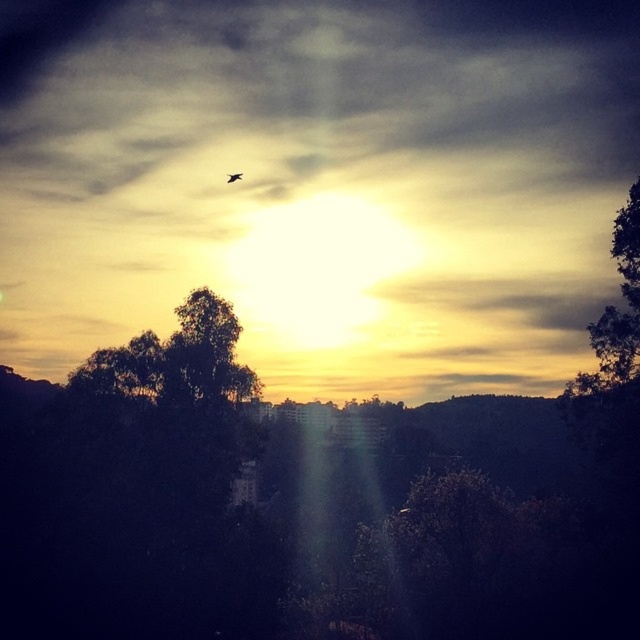
Question: Where is green leafy tree at center located in relation to transparent glass plane at upper center in the image?

Choices:
 (A) above
 (B) below

Answer: (B)

Question: Is green leafy tree at center to the left of transparent glass plane at upper center from the viewer's perspective?

Choices:
 (A) yes
 (B) no

Answer: (B)

Question: Which object is closer to the camera taking this photo?

Choices:
 (A) transparent glass plane at upper center
 (B) green leafy tree at center

Answer: (B)

Question: Can you confirm if smokey gray cloud at upper center is thinner than green leafy tree at center?

Choices:
 (A) no
 (B) yes

Answer: (A)

Question: Which point is farther to the camera?

Choices:
 (A) transparent glass plane at upper center
 (B) smokey gray cloud at upper center
 (C) green leafy tree at center

Answer: (A)

Question: Which point appears closest to the camera in this image?

Choices:
 (A) pyautogui.click(x=230, y=380)
 (B) pyautogui.click(x=8, y=356)

Answer: (A)